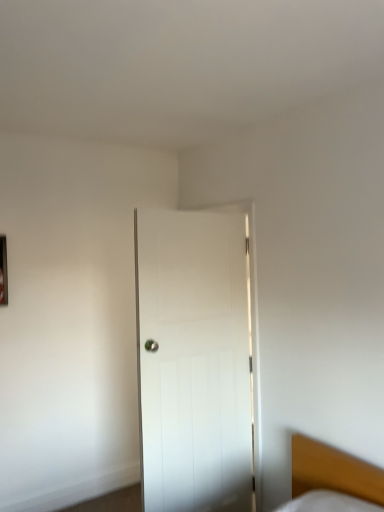
Question: Can you see wooden bed at lower right touching metallic rectangular frame at left?

Choices:
 (A) no
 (B) yes

Answer: (A)

Question: Would you say wooden bed at lower right is a long distance from metallic rectangular frame at left?

Choices:
 (A) yes
 (B) no

Answer: (A)

Question: Would you say wooden bed at lower right is outside metallic rectangular frame at left?

Choices:
 (A) yes
 (B) no

Answer: (A)

Question: Is wooden bed at lower right taller than metallic rectangular frame at left?

Choices:
 (A) yes
 (B) no

Answer: (B)

Question: Does wooden bed at lower right turn towards metallic rectangular frame at left?

Choices:
 (A) yes
 (B) no

Answer: (B)

Question: Is point (228, 377) closer or farther from the camera than point (309, 485)?

Choices:
 (A) farther
 (B) closer

Answer: (A)

Question: From the image's perspective, is white wooden door at center above or below wooden bed at lower right?

Choices:
 (A) below
 (B) above

Answer: (B)

Question: Looking at their shapes, would you say white wooden door at center is wider or thinner than wooden bed at lower right?

Choices:
 (A) thin
 (B) wide

Answer: (A)

Question: Is white wooden door at center situated inside wooden bed at lower right or outside?

Choices:
 (A) outside
 (B) inside

Answer: (A)

Question: Considering the relative positions of white wooden door at center and metallic rectangular frame at left in the image provided, is white wooden door at center to the left or to the right of metallic rectangular frame at left?

Choices:
 (A) left
 (B) right

Answer: (B)

Question: From a real-world perspective, is white wooden door at center positioned above or below metallic rectangular frame at left?

Choices:
 (A) above
 (B) below

Answer: (B)

Question: Relative to metallic rectangular frame at left, is white wooden door at center in front or behind?

Choices:
 (A) front
 (B) behind

Answer: (A)

Question: From the image's perspective, is white wooden door at center located above or below metallic rectangular frame at left?

Choices:
 (A) below
 (B) above

Answer: (A)

Question: From the image's perspective, is metallic rectangular frame at left positioned above or below white wooden door at center?

Choices:
 (A) below
 (B) above

Answer: (B)

Question: Considering the positions of point (0, 284) and point (228, 308), is point (0, 284) closer or farther from the camera than point (228, 308)?

Choices:
 (A) farther
 (B) closer

Answer: (A)